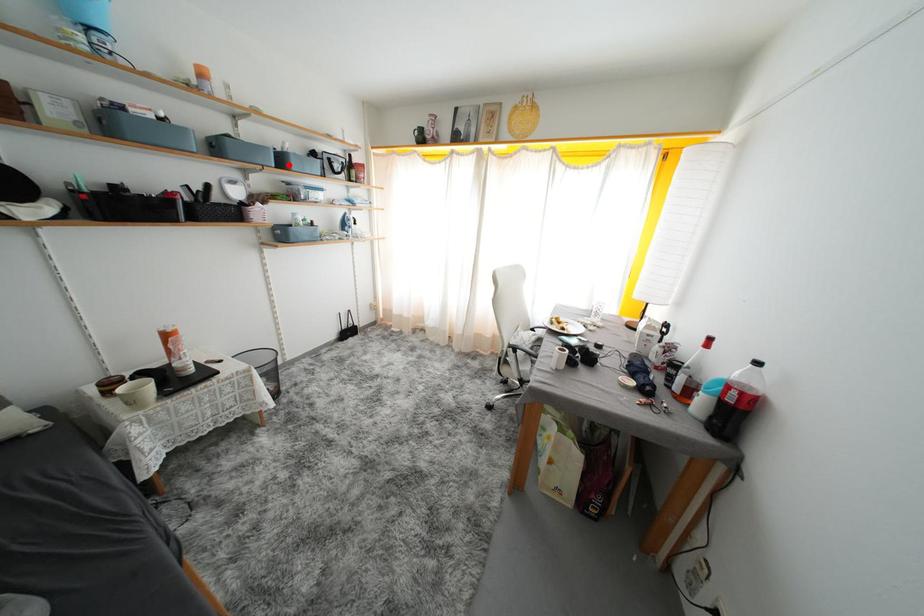
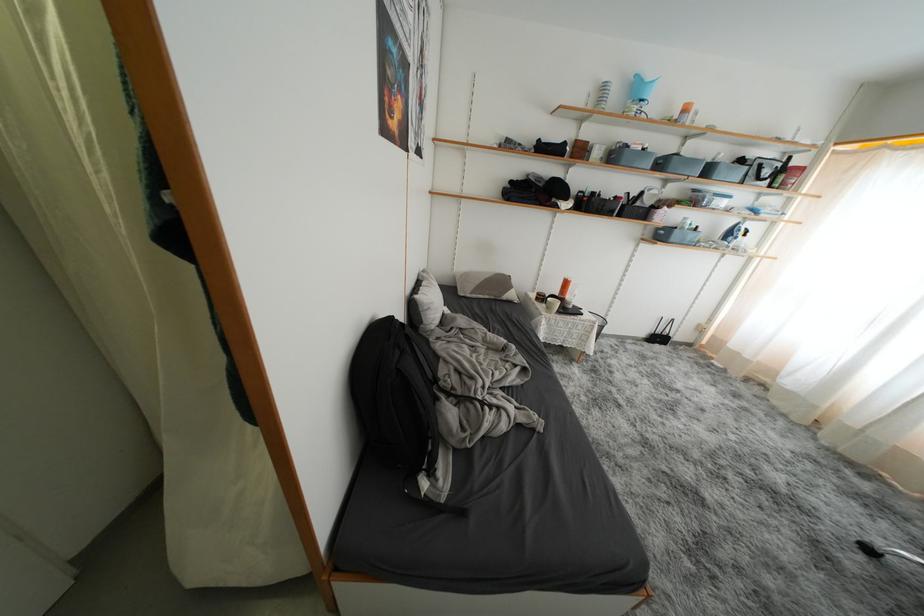
Where in the second image is the point corresponding to the highlighted location from the first image?

(714, 175)